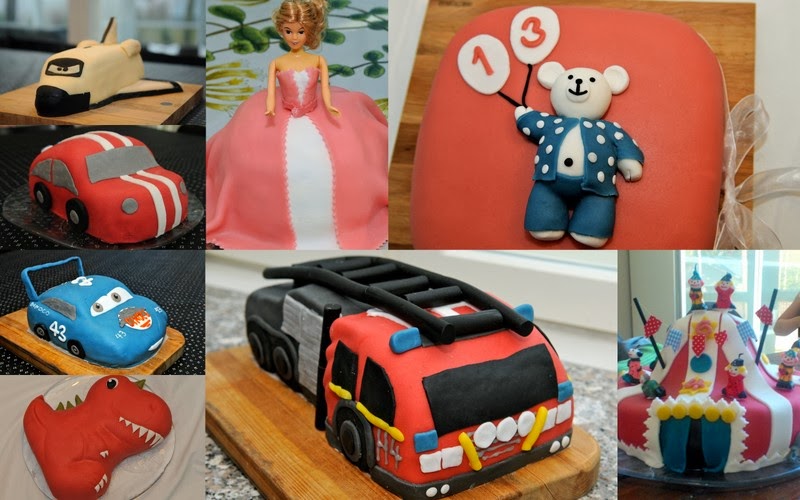
Locate an element on the screen. black ladder is located at coordinates (429, 325).